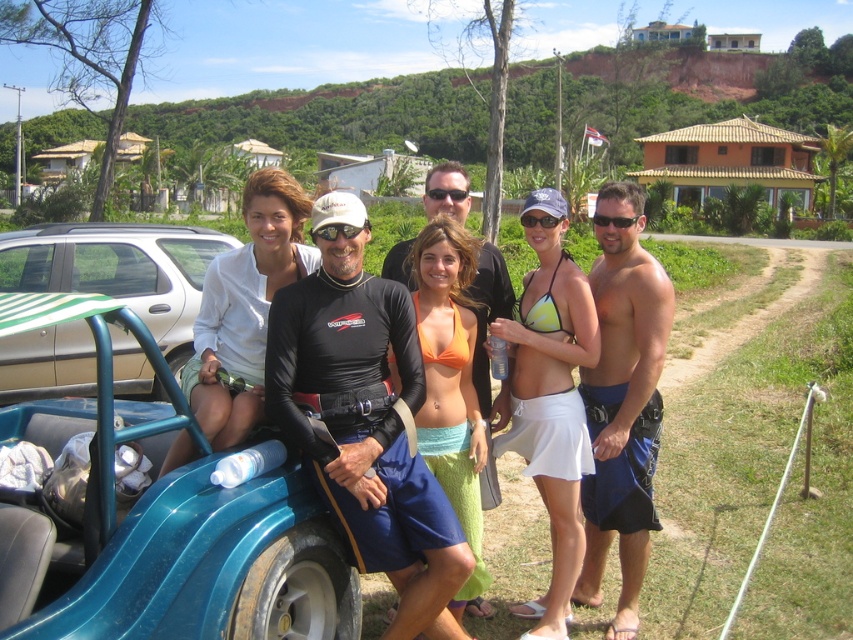
Question: Which of the following is the farthest from the observer?

Choices:
 (A) (347, 234)
 (B) (380, 326)
 (C) (606, 292)
 (D) (456, 195)

Answer: (D)

Question: Considering the real-world distances, which object is farthest from the yellow-green bikini top at center?

Choices:
 (A) black matte goggles at center
 (B) black rubber goggles at center

Answer: (B)

Question: Is blue plastic golf cart at left to the right of white matte shirt at center from the viewer's perspective?

Choices:
 (A) yes
 (B) no

Answer: (A)

Question: Which point appears closest to the camera in this image?

Choices:
 (A) (274, 365)
 (B) (270, 276)
 (C) (537, 305)
 (D) (656, 312)

Answer: (A)

Question: Is blue plastic golf cart at left bigger than black rubber goggles at center?

Choices:
 (A) yes
 (B) no

Answer: (A)

Question: Can you confirm if shiny blue shorts at center is positioned below white matte shirt at center?

Choices:
 (A) no
 (B) yes

Answer: (B)